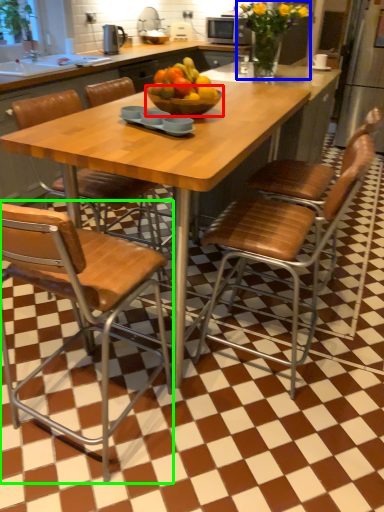
Question: Based on their relative distances, which object is farther from bowl (highlighted by a red box)? Choose from flower (highlighted by a blue box) and chair (highlighted by a green box).

Choices:
 (A) flower
 (B) chair

Answer: (A)